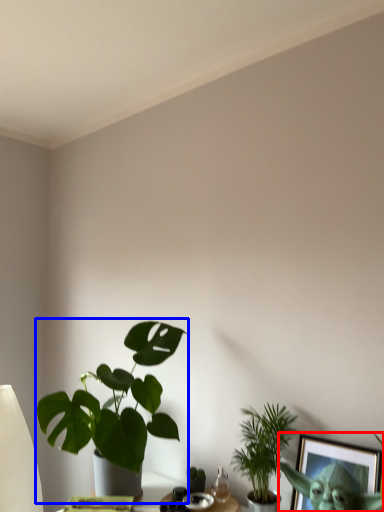
Question: Which object is closer to the camera taking this photo, picture frame (highlighted by a red box) or houseplant (highlighted by a blue box)?

Choices:
 (A) picture frame
 (B) houseplant

Answer: (A)